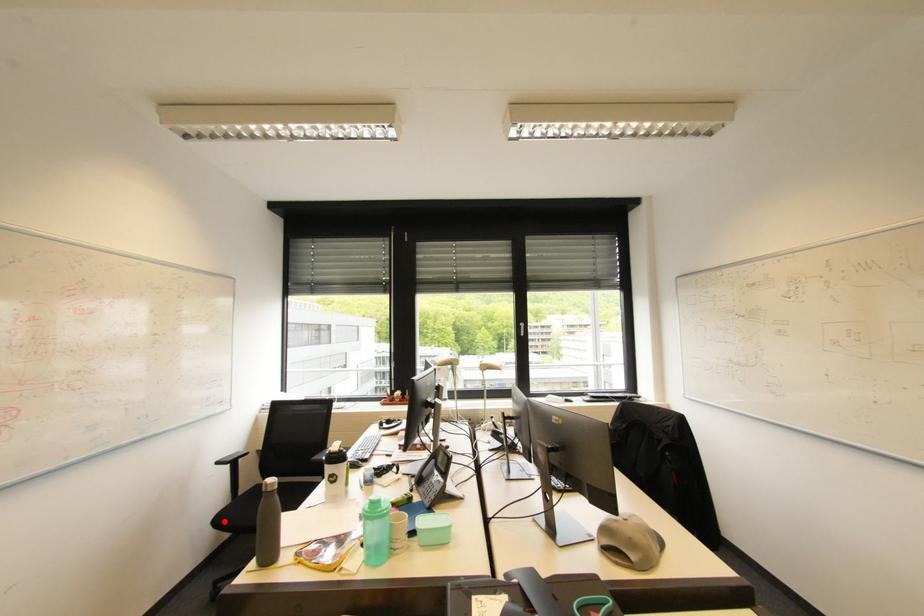
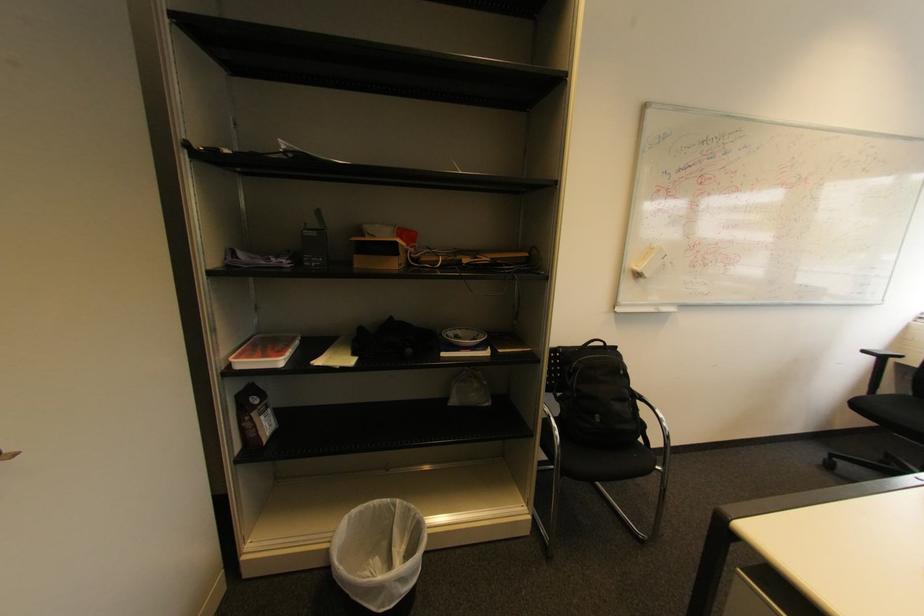
Question: A red point is marked in image1. In image2, is the corresponding 3D point closer to the camera or farther? Reply with the corresponding letter.

Choices:
 (A) The corresponding 3D point is closer.
 (B) The corresponding 3D point is farther.

Answer: (B)